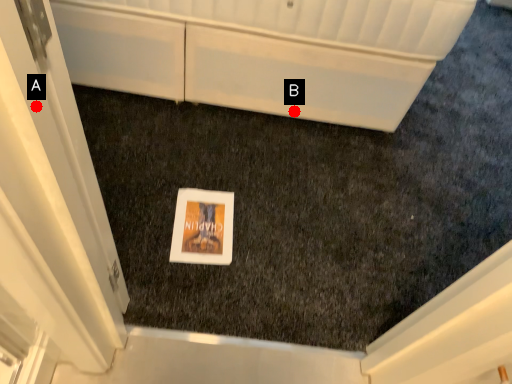
Question: Two points are circled on the image, labeled by A and B beside each circle. Among these points, which one is farthest from the camera?

Choices:
 (A) A is further
 (B) B is further

Answer: (B)